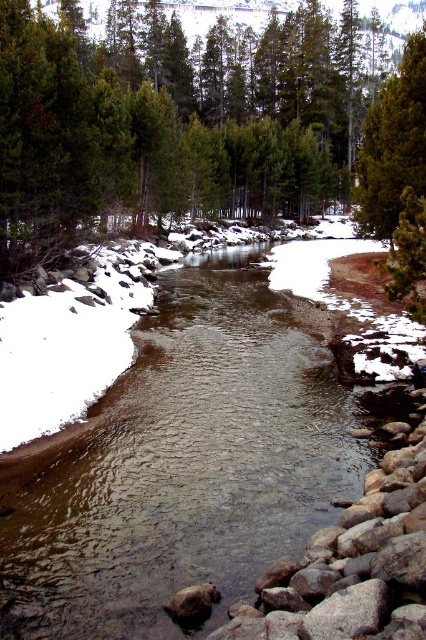
Question: In this image, where is green matte tree at center located relative to green matte tree at upper center?

Choices:
 (A) left
 (B) right

Answer: (A)

Question: From the image, what is the correct spatial relationship of green matte tree at center in relation to green matte tree at upper center?

Choices:
 (A) below
 (B) above

Answer: (B)

Question: Is green matte tree at center closer to the viewer compared to green matte tree at upper center?

Choices:
 (A) yes
 (B) no

Answer: (A)

Question: Among these points, which one is farthest from the camera?

Choices:
 (A) (236, 172)
 (B) (368, 134)

Answer: (A)